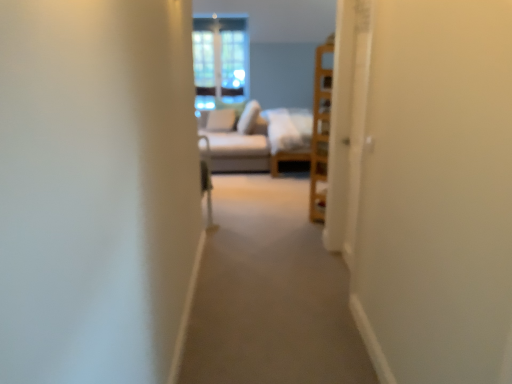
Question: Can you confirm if light beige fabric couch at center is shorter than white soft pillow at center, which is the 1th pillow from right to left?

Choices:
 (A) yes
 (B) no

Answer: (B)

Question: From a real-world perspective, does light beige fabric couch at center stand above white soft pillow at center, which is the 1th pillow from right to left?

Choices:
 (A) no
 (B) yes

Answer: (A)

Question: From a real-world perspective, is light beige fabric couch at center located beneath white soft pillow at center, the second pillow in the left-to-right sequence?

Choices:
 (A) yes
 (B) no

Answer: (A)

Question: Would you say light beige fabric couch at center contains white soft pillow at center, which is the 1th pillow from right to left?

Choices:
 (A) no
 (B) yes

Answer: (A)

Question: Considering the relative sizes of light beige fabric couch at center and white soft pillow at center, the second pillow in the left-to-right sequence, in the image provided, is light beige fabric couch at center taller than white soft pillow at center, the second pillow in the left-to-right sequence,?

Choices:
 (A) no
 (B) yes

Answer: (B)

Question: From a real-world perspective, is clear glass window at center physically located above or below light beige fabric couch at center?

Choices:
 (A) above
 (B) below

Answer: (A)

Question: Based on their sizes in the image, would you say clear glass window at center is bigger or smaller than light beige fabric couch at center?

Choices:
 (A) small
 (B) big

Answer: (A)

Question: Considering the relative positions of clear glass window at center and light beige fabric couch at center in the image provided, is clear glass window at center to the left or to the right of light beige fabric couch at center?

Choices:
 (A) left
 (B) right

Answer: (A)

Question: From the image's perspective, is clear glass window at center above or below light beige fabric couch at center?

Choices:
 (A) above
 (B) below

Answer: (A)

Question: Looking at the image, does white soft pillow at center, which is the 1th pillow from right to left, seem bigger or smaller compared to light beige fabric couch at center?

Choices:
 (A) big
 (B) small

Answer: (B)

Question: From their relative heights in the image, would you say white soft pillow at center, which is the 1th pillow from right to left, is taller or shorter than light beige fabric couch at center?

Choices:
 (A) tall
 (B) short

Answer: (B)

Question: Do you think white soft pillow at center, which is the 1th pillow from right to left, is within light beige fabric couch at center, or outside of it?

Choices:
 (A) inside
 (B) outside

Answer: (B)

Question: Based on their positions, is white soft pillow at center, the second pillow in the left-to-right sequence, located to the left or right of light beige fabric couch at center?

Choices:
 (A) right
 (B) left

Answer: (B)

Question: From the image's perspective, is light beige fabric couch at center positioned above or below clear glass window at center?

Choices:
 (A) above
 (B) below

Answer: (B)

Question: Is light beige fabric couch at center bigger or smaller than clear glass window at center?

Choices:
 (A) small
 (B) big

Answer: (B)